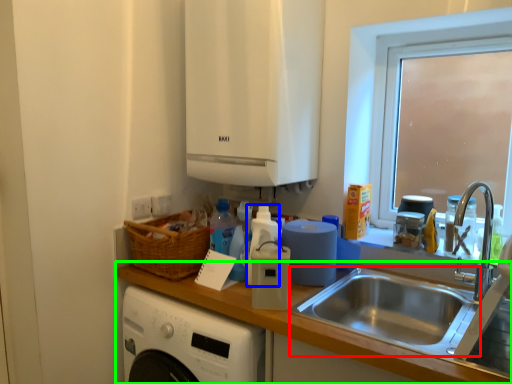
Question: Based on their relative distances, which object is farther from sink (highlighted by a red box)? Choose from bottle (highlighted by a blue box) and countertop (highlighted by a green box).

Choices:
 (A) bottle
 (B) countertop

Answer: (A)